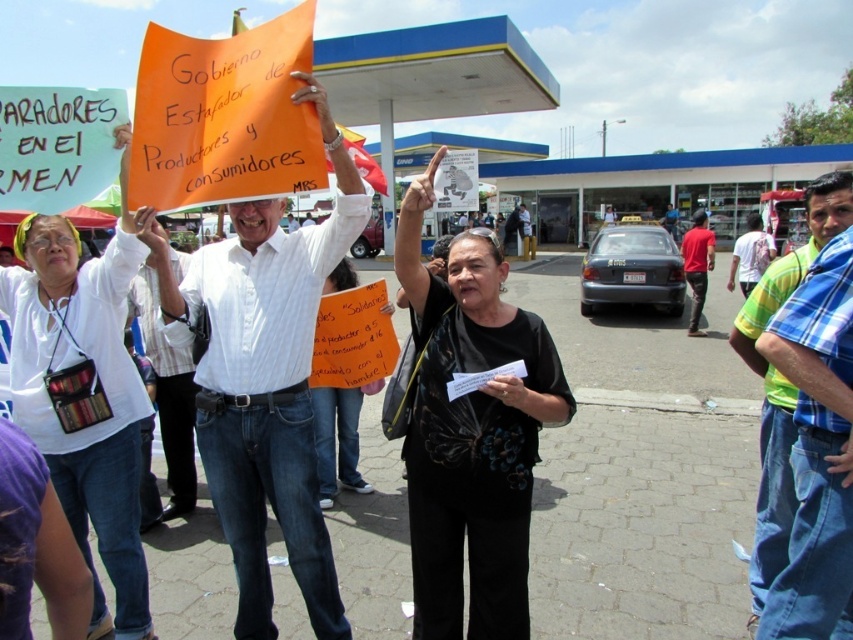
Question: Which of these objects is positioned farthest from the red cotton shirt at right?

Choices:
 (A) dark blue jeans at right
 (B) blue plaid shirt at right

Answer: (B)

Question: Does white shirt at center have a larger size compared to blue plaid shirt at right?

Choices:
 (A) no
 (B) yes

Answer: (A)

Question: Which of the following is the farthest from the observer?

Choices:
 (A) (747, 236)
 (B) (769, 314)
 (C) (694, 314)
 (D) (254, 266)

Answer: (C)

Question: Which object is the closest to the white shirt at center?

Choices:
 (A) dark blue jeans at right
 (B) blue plaid shirt at right

Answer: (B)

Question: Can you confirm if white shirt at center is positioned below blue plaid shirt at right?

Choices:
 (A) no
 (B) yes

Answer: (A)

Question: Does white shirt at center have a smaller size compared to red cotton shirt at right?

Choices:
 (A) yes
 (B) no

Answer: (A)